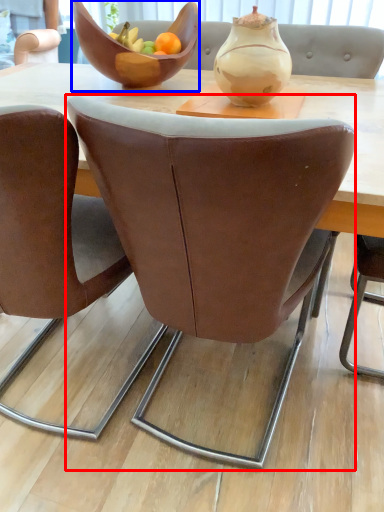
Question: Which of the following is the farthest to the observer, chair (highlighted by a red box) or bowl (highlighted by a blue box)?

Choices:
 (A) chair
 (B) bowl

Answer: (B)